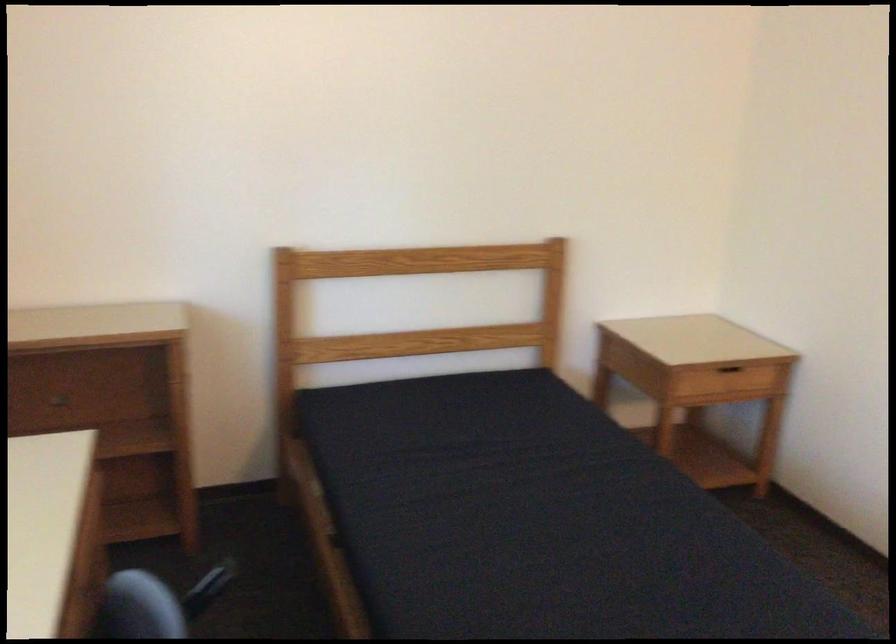
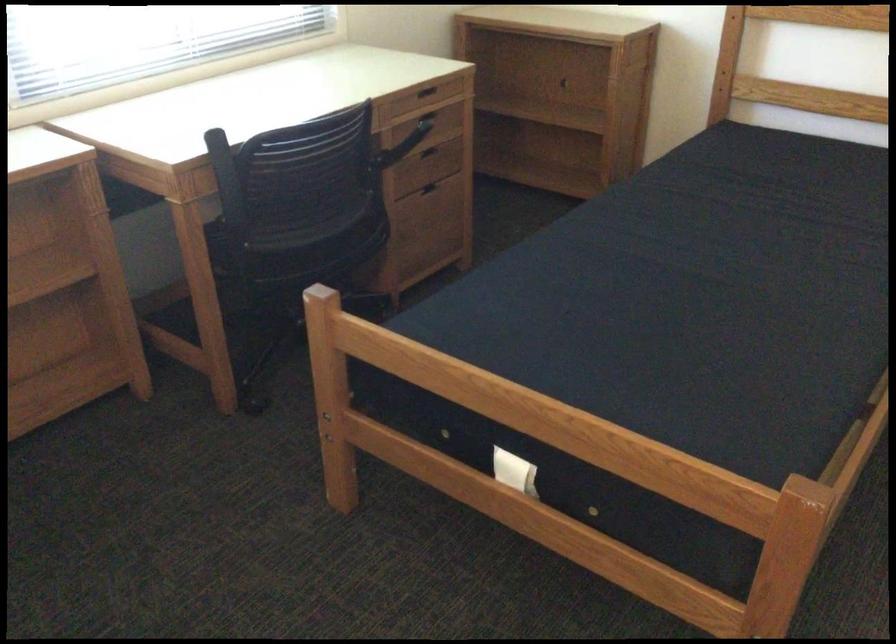
In the second image, find the point that corresponds to (x=89, y=507) in the first image.

(424, 91)